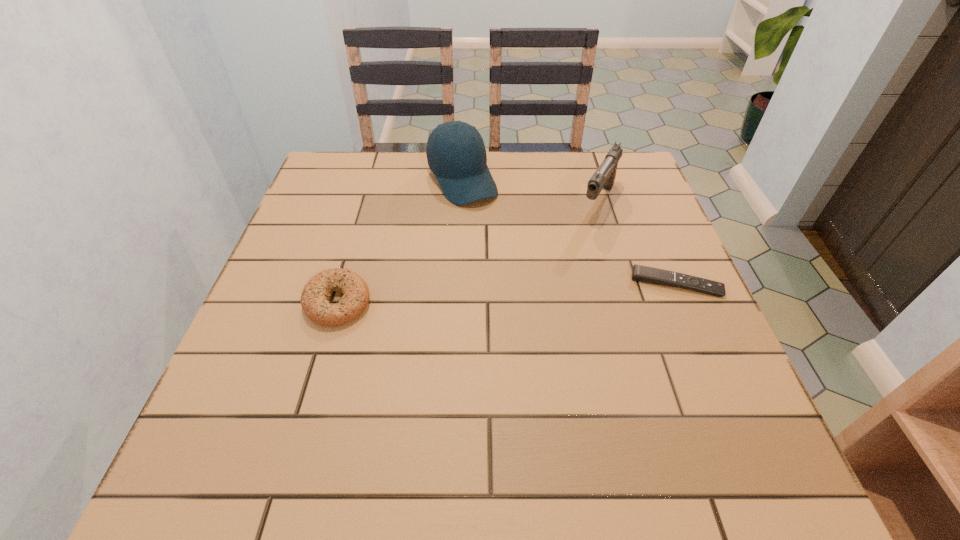
The width and height of the screenshot is (960, 540). Find the location of `bagel`. bagel is located at coordinates (315, 297).

The height and width of the screenshot is (540, 960). I want to click on the second shortest object, so click(x=315, y=297).

Image resolution: width=960 pixels, height=540 pixels. Identify the location of the shortest object. (640, 273).

Where is `gun`? The image size is (960, 540). gun is located at coordinates (603, 178).

What are the coordinates of `baseball cap` in the screenshot? It's located at (456, 154).

The width and height of the screenshot is (960, 540). What are the coordinates of `vacant space located on the back of the third tallest object` in the screenshot? It's located at (366, 209).

The width and height of the screenshot is (960, 540). What are the coordinates of `blank space located on the back of the remote control` in the screenshot? It's located at (653, 227).

The width and height of the screenshot is (960, 540). In order to click on vacant space located in the direction the gun is aimed in this screenshot , I will do `click(533, 323)`.

You are a GUI agent. You are given a task and a screenshot of the screen. Output one action in this format:
    pyautogui.click(x=<x>, y=<y>)
    Task: Click on the free region located 0.180m in the direction the gun is aimed
    This screenshot has height=540, width=960.
    Given the screenshot: What is the action you would take?
    pyautogui.click(x=566, y=266)

I want to click on vacant space located in the direction the gun is aimed, so click(x=562, y=274).